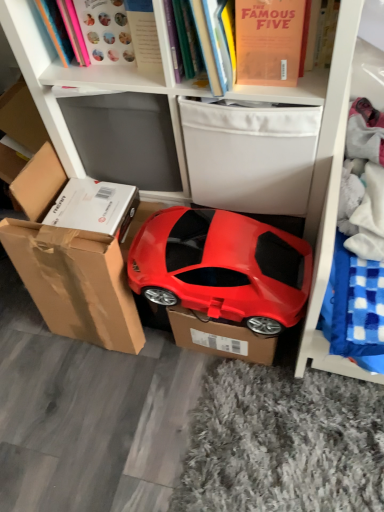
The width and height of the screenshot is (384, 512). I want to click on vacant space to the right of brown cardboard box at lower left, so click(157, 353).